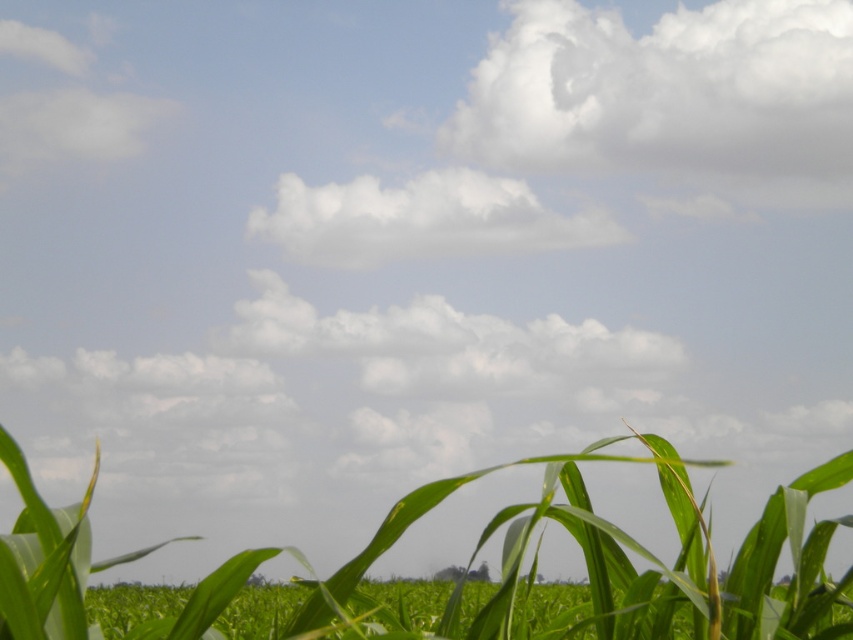
You are a photographer standing in the middle of a field of green crops. You want to capture a photo that includes both the white fluffy cloud at upper center and a close view of the crops. Since you can only focus on one subject clearly, which one should you focus on to ensure it appears sharp in the photo?

You should focus on the white fluffy cloud at upper center because it is farther away from the camera than the crops, which are in the foreground. This ensures the cloud will be sharp while the crops may appear slightly out of focus.

You are a drone operator flying a drone over the rural landscape. You need to determine the order of two points in the scene to ensure safe navigation. Which point, point (x=840, y=636) or point (x=329, y=200), is closer to your drone camera?

Point (x=840, y=636) is closer to the camera than point (x=329, y=200).

You are standing in a field of tall green crops. There is a point at coordinates point [77,628] that you need to reach. Considering the crops are 7 feet tall, can you walk straight to that point without bending down?

The distance between you and point [77,628] is 8.27 feet. Since the crops are 7 feet tall, they are shorter than your height, so you can walk straight to the point without bending down.